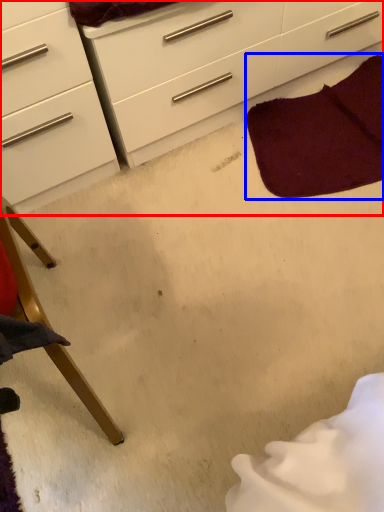
Question: Which object is closer to the camera taking this photo, chest of drawers (highlighted by a red box) or blanket (highlighted by a blue box)?

Choices:
 (A) chest of drawers
 (B) blanket

Answer: (A)